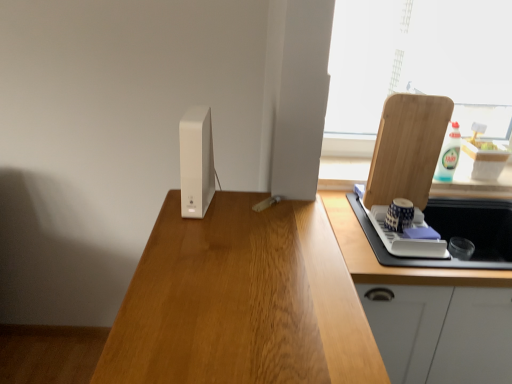
Question: Does blue and white ceramic cup at right, which appears as the first appliance when viewed from the back, come behind wooden cutting board at right?

Choices:
 (A) no
 (B) yes

Answer: (B)

Question: Considering the relative positions of blue and white ceramic cup at right, acting as the second appliance starting from the top, and wooden cutting board at right in the image provided, is blue and white ceramic cup at right, acting as the second appliance starting from the top, in front of wooden cutting board at right?

Choices:
 (A) yes
 (B) no

Answer: (B)

Question: Does blue and white ceramic cup at right, acting as the second appliance starting from the left, have a greater width compared to wooden cutting board at right?

Choices:
 (A) no
 (B) yes

Answer: (B)

Question: From the image's perspective, is blue and white ceramic cup at right, placed as the first appliance when sorted from right to left, located above wooden cutting board at right?

Choices:
 (A) yes
 (B) no

Answer: (B)

Question: Is blue and white ceramic cup at right, which appears as the first appliance when viewed from the back, turned away from wooden cutting board at right?

Choices:
 (A) no
 (B) yes

Answer: (B)

Question: From a real-world perspective, is white matte router at center, the 1th appliance from the top, positioned above or below wooden cutting board at right?

Choices:
 (A) above
 (B) below

Answer: (A)

Question: Based on their positions, is white matte router at center, which is the second appliance in bottom-to-top order, located to the left or right of wooden cutting board at right?

Choices:
 (A) right
 (B) left

Answer: (B)

Question: Considering the positions of point (204, 112) and point (423, 190), is point (204, 112) closer or farther from the camera than point (423, 190)?

Choices:
 (A) closer
 (B) farther

Answer: (A)

Question: Is white matte router at center, which is counted as the 2th appliance, starting from the back, taller or shorter than wooden cutting board at right?

Choices:
 (A) short
 (B) tall

Answer: (A)

Question: Is blue and white ceramic cup at right, the 1th appliance from the bottom, in front of or behind white matte router at center, positioned as the first appliance in front-to-back order, in the image?

Choices:
 (A) front
 (B) behind

Answer: (B)

Question: Considering the positions of blue and white ceramic cup at right, which appears as the first appliance when viewed from the back, and white matte router at center, positioned as the first appliance in front-to-back order, in the image, is blue and white ceramic cup at right, which appears as the first appliance when viewed from the back, taller or shorter than white matte router at center, positioned as the first appliance in front-to-back order,?

Choices:
 (A) tall
 (B) short

Answer: (B)

Question: Is blue and white ceramic cup at right, which appears as the first appliance when viewed from the back, to the left or to the right of white matte router at center, which is counted as the 2th appliance, starting from the back, in the image?

Choices:
 (A) right
 (B) left

Answer: (A)

Question: Which is correct: blue and white ceramic cup at right, acting as the second appliance starting from the left, is inside white matte router at center, which is the 1th appliance in left-to-right order, or outside of it?

Choices:
 (A) inside
 (B) outside

Answer: (B)

Question: From the image's perspective, is blue and white ceramic cup at right, the 1th appliance from the bottom, above or below white glossy cabinet at right?

Choices:
 (A) above
 (B) below

Answer: (A)

Question: Would you say blue and white ceramic cup at right, placed as the first appliance when sorted from right to left, is inside or outside white glossy cabinet at right?

Choices:
 (A) outside
 (B) inside

Answer: (A)